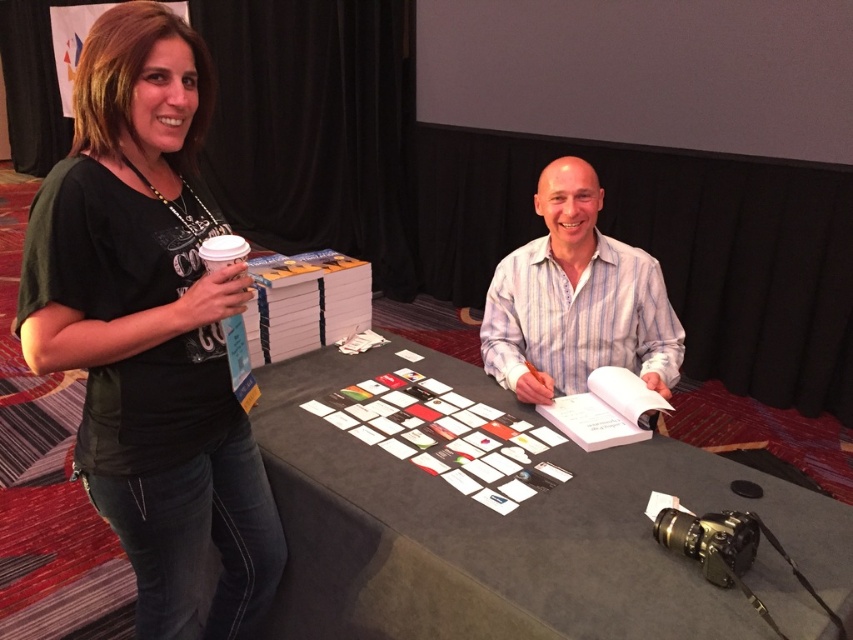
Who is positioned more to the left, black matte t-shirt at upper left or black fabric table at center?

Positioned to the left is black matte t-shirt at upper left.

Does point (199, 76) come closer to viewer compared to point (451, 488)?

Yes, point (199, 76) is in front of point (451, 488).

Who is more distant from viewer, (138,380) or (480,577)?

Point (138,380)

Identify the location of black matte t-shirt at upper left. (151, 330).

Is black fabric table at center to the left of white striped shirt at center from the viewer's perspective?

Correct, you'll find black fabric table at center to the left of white striped shirt at center.

Is black fabric table at center to the right of white striped shirt at center from the viewer's perspective?

Incorrect, black fabric table at center is not on the right side of white striped shirt at center.

Between point (548, 452) and point (665, 369), which one is positioned behind?

Positioned behind is point (665, 369).

The image size is (853, 640). Identify the location of black fabric table at center. (505, 529).

Does black matte t-shirt at upper left have a larger size compared to white striped shirt at center?

Yes, black matte t-shirt at upper left is bigger than white striped shirt at center.

The image size is (853, 640). What do you see at coordinates (151, 330) in the screenshot?
I see `black matte t-shirt at upper left` at bounding box center [151, 330].

Is point (120, 196) positioned behind point (630, 342)?

No, (120, 196) is in front of (630, 342).

Where is `black matte t-shirt at upper left`? This screenshot has width=853, height=640. black matte t-shirt at upper left is located at coordinates (151, 330).